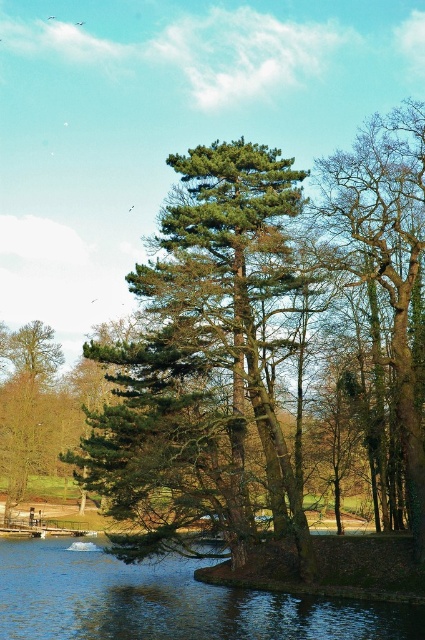
Question: Is brown textured tree at right bigger than brown rough tree at left?

Choices:
 (A) yes
 (B) no

Answer: (B)

Question: Which of the following is the closest to the observer?

Choices:
 (A) brown rough tree at left
 (B) brown textured tree at right
 (C) blue reflective water at lower center

Answer: (C)

Question: Observing the image, what is the correct spatial positioning of green textured tree at center in reference to blue reflective water at lower center?

Choices:
 (A) left
 (B) right

Answer: (B)

Question: Can you confirm if brown textured tree at right is positioned above brown rough tree at left?

Choices:
 (A) no
 (B) yes

Answer: (B)

Question: Considering the real-world distances, which object is closest to the green textured tree at center?

Choices:
 (A) blue reflective water at lower center
 (B) brown textured tree at right
 (C) brown rough tree at left

Answer: (B)

Question: Which object is closer to the camera taking this photo?

Choices:
 (A) brown rough tree at left
 (B) brown textured tree at right
 (C) blue reflective water at lower center

Answer: (C)